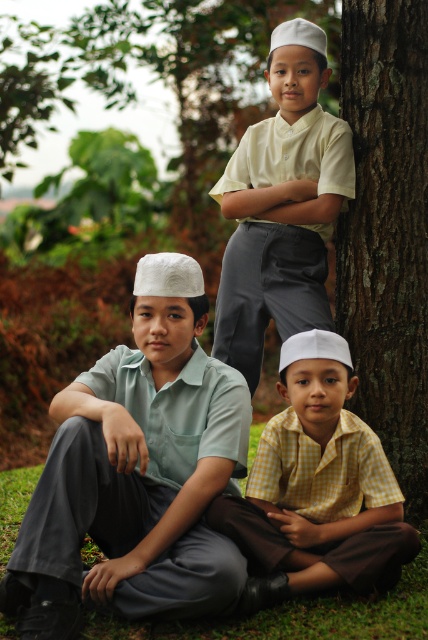
Question: Does matte green shirt at center have a smaller size compared to green grass at lower center?

Choices:
 (A) no
 (B) yes

Answer: (A)

Question: Which object is the farthest from the matte yellow shirt at upper center?

Choices:
 (A) matte green shirt at center
 (B) green grass at lower center
 (C) yellow checkered shirt at lower center

Answer: (B)

Question: Which point is closer to the camera?

Choices:
 (A) matte yellow shirt at upper center
 (B) smooth bark tree at right
 (C) green grass at lower center

Answer: (C)

Question: Is smooth bark tree at right positioned before matte yellow shirt at upper center?

Choices:
 (A) yes
 (B) no

Answer: (A)

Question: Which is nearer to the yellow checkered shirt at lower center?

Choices:
 (A) matte green shirt at center
 (B) green grass at lower center
 (C) matte yellow shirt at upper center
 (D) smooth bark tree at right

Answer: (A)

Question: Can you confirm if smooth bark tree at right is positioned above yellow checkered shirt at lower center?

Choices:
 (A) yes
 (B) no

Answer: (A)